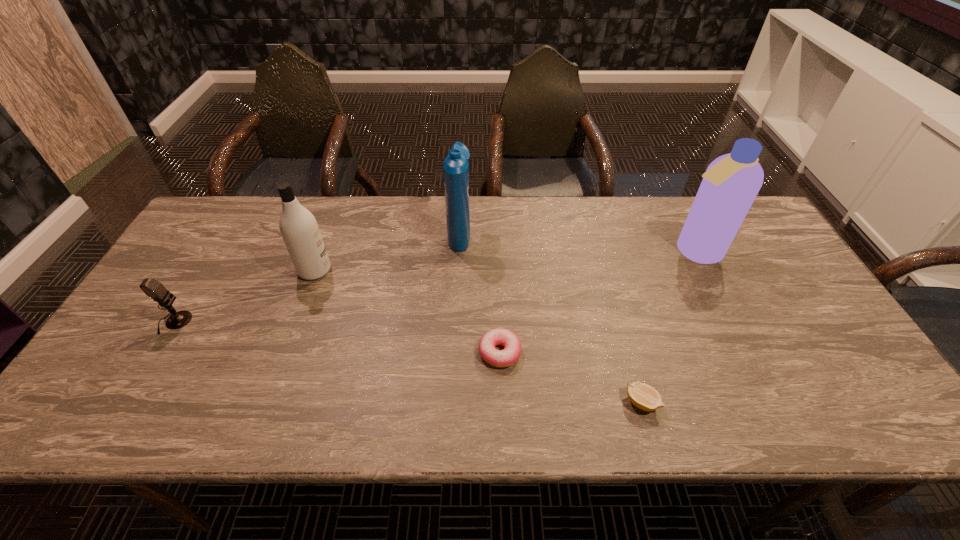
The height and width of the screenshot is (540, 960). Identify the location of the rightmost object. (731, 182).

I want to click on the third object from left to right, so click(x=455, y=166).

I want to click on the leftmost shampoo, so click(x=300, y=231).

At what (x,y) coordinates should I click in order to perform the action: click on the fourth tallest object. Please return your answer as a coordinate pair (x, y). Looking at the image, I should click on (151, 287).

Where is `the leftmost object`? The image size is (960, 540). the leftmost object is located at coordinates click(151, 287).

At what (x,y) coordinates should I click in order to perform the action: click on the third object from right to left. Please return your answer as a coordinate pair (x, y). Looking at the image, I should click on (510, 354).

Locate an element on the screen. The image size is (960, 540). the second object from right to left is located at coordinates (643, 396).

You are a GUI agent. You are given a task and a screenshot of the screen. Output one action in this format:
    pyautogui.click(x=<x>, y=<y>)
    Task: Click on the lemon
    
    Given the screenshot: What is the action you would take?
    pyautogui.click(x=643, y=396)

This screenshot has width=960, height=540. In order to click on vacant space located on the left of the rightmost object in this screenshot , I will do `click(582, 251)`.

The image size is (960, 540). Identify the location of free location located on the left of the second shampoo from right to left. [321, 234].